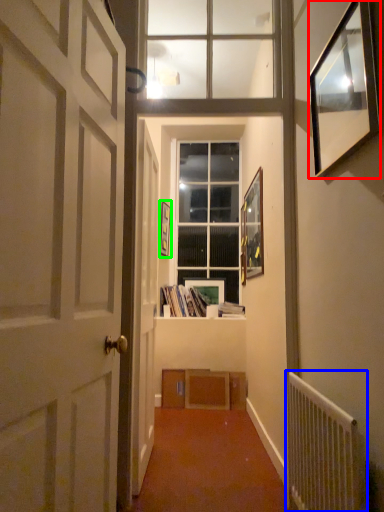
Question: Which is nearer to the picture frame (highlighted by a red box)? radiator (highlighted by a blue box) or picture frame (highlighted by a green box).

Choices:
 (A) radiator
 (B) picture frame

Answer: (A)